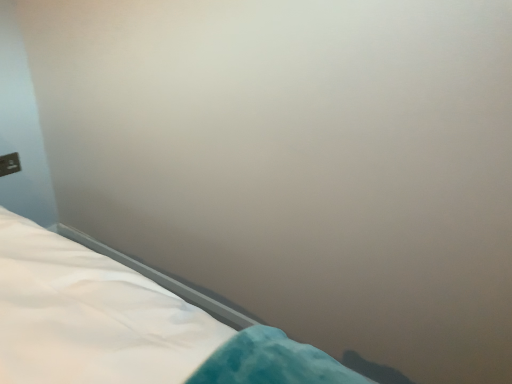
Where is `white fabric bed at lower left`? The height and width of the screenshot is (384, 512). white fabric bed at lower left is located at coordinates (90, 316).

The height and width of the screenshot is (384, 512). What do you see at coordinates (90, 316) in the screenshot?
I see `white fabric bed at lower left` at bounding box center [90, 316].

What is the approximate height of white fabric bed at lower left?

white fabric bed at lower left is 4.09 inches tall.

Image resolution: width=512 pixels, height=384 pixels. Describe the element at coordinates (9, 164) in the screenshot. I see `matte black outlet at upper left` at that location.

Locate an element on the screen. This screenshot has width=512, height=384. matte black outlet at upper left is located at coordinates tap(9, 164).

Locate an element on the screen. white fabric bed at lower left is located at coordinates (90, 316).

Can you confirm if white fabric bed at lower left is positioned to the left of matte black outlet at upper left?

No, white fabric bed at lower left is not to the left of matte black outlet at upper left.

In the image, is white fabric bed at lower left positioned in front of or behind matte black outlet at upper left?

white fabric bed at lower left is in front of matte black outlet at upper left.

Considering the points (123, 282) and (10, 163), which point is in front, point (123, 282) or point (10, 163)?

Point (123, 282)

From the image's perspective, between white fabric bed at lower left and matte black outlet at upper left, who is located below?

white fabric bed at lower left.

From a real-world perspective, is white fabric bed at lower left above or below matte black outlet at upper left?

In terms of real-world spatial position, white fabric bed at lower left is below matte black outlet at upper left.

Is white fabric bed at lower left wider than matte black outlet at upper left?

Yes.

Considering the relative sizes of white fabric bed at lower left and matte black outlet at upper left in the image provided, is white fabric bed at lower left taller than matte black outlet at upper left?

Yes.

Can you confirm if white fabric bed at lower left is bigger than matte black outlet at upper left?

Correct, white fabric bed at lower left is larger in size than matte black outlet at upper left.

Would you say white fabric bed at lower left is outside matte black outlet at upper left?

white fabric bed at lower left lies outside matte black outlet at upper left's area.

Would you consider white fabric bed at lower left to be distant from matte black outlet at upper left?

Absolutely, white fabric bed at lower left is distant from matte black outlet at upper left.

Could you tell me if white fabric bed at lower left is turned towards matte black outlet at upper left?

No.

How many degrees apart are the facing directions of white fabric bed at lower left and matte black outlet at upper left?

There is a 89.9-degree angle between the facing directions of white fabric bed at lower left and matte black outlet at upper left.

Where is `electric outlet above the white fabric bed at lower left (from a real-world perspective)`? The image size is (512, 384). electric outlet above the white fabric bed at lower left (from a real-world perspective) is located at coordinates (9, 164).

Is matte black outlet at upper left to the left of white fabric bed at lower left from the viewer's perspective?

Yes, matte black outlet at upper left is to the left of white fabric bed at lower left.

From the picture: Considering the positions of objects matte black outlet at upper left and white fabric bed at lower left in the image provided, who is behind, matte black outlet at upper left or white fabric bed at lower left?

matte black outlet at upper left.

Which is more distant, (0, 163) or (23, 222)?

The point (0, 163) is more distant.

From the image's perspective, which is above, matte black outlet at upper left or white fabric bed at lower left?

From the image's view, matte black outlet at upper left is above.

From a real-world perspective, which is physically below, matte black outlet at upper left or white fabric bed at lower left?

From a 3D spatial view, white fabric bed at lower left is below.

Which object is wider, matte black outlet at upper left or white fabric bed at lower left?

With larger width is white fabric bed at lower left.

Can you confirm if matte black outlet at upper left is taller than white fabric bed at lower left?

In fact, matte black outlet at upper left may be shorter than white fabric bed at lower left.

Based on the photo, between matte black outlet at upper left and white fabric bed at lower left, which one has smaller size?

matte black outlet at upper left is smaller.

Is matte black outlet at upper left outside of white fabric bed at lower left?

Yes, matte black outlet at upper left is outside of white fabric bed at lower left.

Would you consider matte black outlet at upper left to be distant from white fabric bed at lower left?

matte black outlet at upper left is far away from white fabric bed at lower left.

Is matte black outlet at upper left aimed at white fabric bed at lower left?

No, matte black outlet at upper left is not facing towards white fabric bed at lower left.

Can you tell me how much matte black outlet at upper left and white fabric bed at lower left differ in facing direction?

There is a 89.9-degree angle between the facing directions of matte black outlet at upper left and white fabric bed at lower left.

At what (x,y) coordinates should I click in order to perform the action: click on electric outlet behind the white fabric bed at lower left. Please return your answer as a coordinate pair (x, y). The width and height of the screenshot is (512, 384). Looking at the image, I should click on (9, 164).

Where is `bed to the right of matte black outlet at upper left`? The image size is (512, 384). bed to the right of matte black outlet at upper left is located at coordinates (90, 316).

Find the location of a particular element. This screenshot has height=384, width=512. bed below the matte black outlet at upper left (from the image's perspective) is located at coordinates (90, 316).